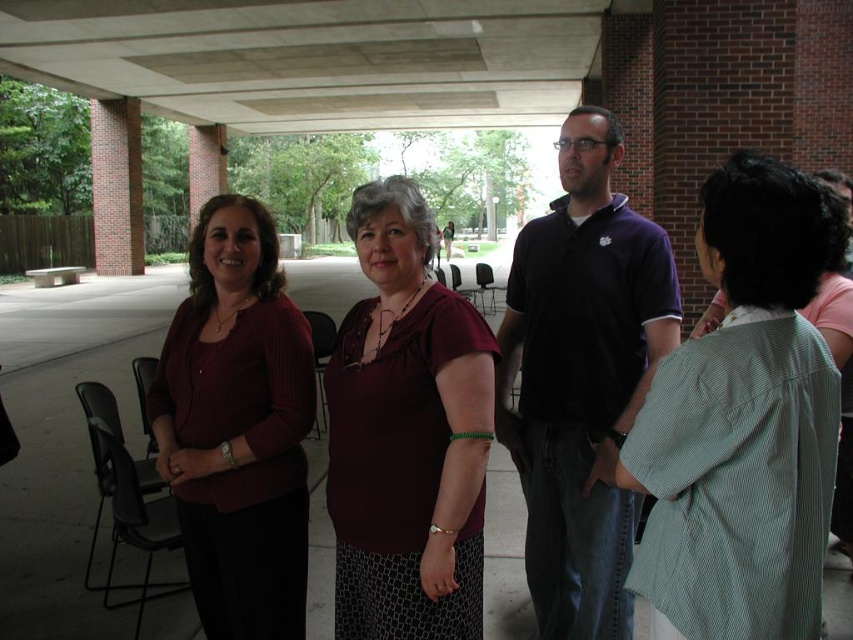
This screenshot has width=853, height=640. Describe the element at coordinates (743, 422) in the screenshot. I see `green striped shirt at center` at that location.

Does point (666, 632) lie in front of point (297, 554)?

That is True.

Is point (752, 339) more distant than point (299, 472)?

No, (752, 339) is in front of (299, 472).

Find the location of a particular element. Image resolution: width=853 pixels, height=640 pixels. green striped shirt at center is located at coordinates (743, 422).

Is green striped shirt at center to the left of purple cotton polo shirt at center from the viewer's perspective?

Incorrect, green striped shirt at center is not on the left side of purple cotton polo shirt at center.

Which of these two, green striped shirt at center or purple cotton polo shirt at center, stands shorter?

Standing shorter between the two is green striped shirt at center.

The width and height of the screenshot is (853, 640). What do you see at coordinates (743, 422) in the screenshot?
I see `green striped shirt at center` at bounding box center [743, 422].

I want to click on green striped shirt at center, so 743,422.

The width and height of the screenshot is (853, 640). What do you see at coordinates (581, 380) in the screenshot?
I see `purple cotton polo shirt at center` at bounding box center [581, 380].

Does purple cotton polo shirt at center appear over matte maroon sweater at center?

Yes, purple cotton polo shirt at center is above matte maroon sweater at center.

Measure the distance between point (x=593, y=413) and camera.

The distance of point (x=593, y=413) from camera is 2.29 meters.

This screenshot has width=853, height=640. I want to click on purple cotton polo shirt at center, so click(581, 380).